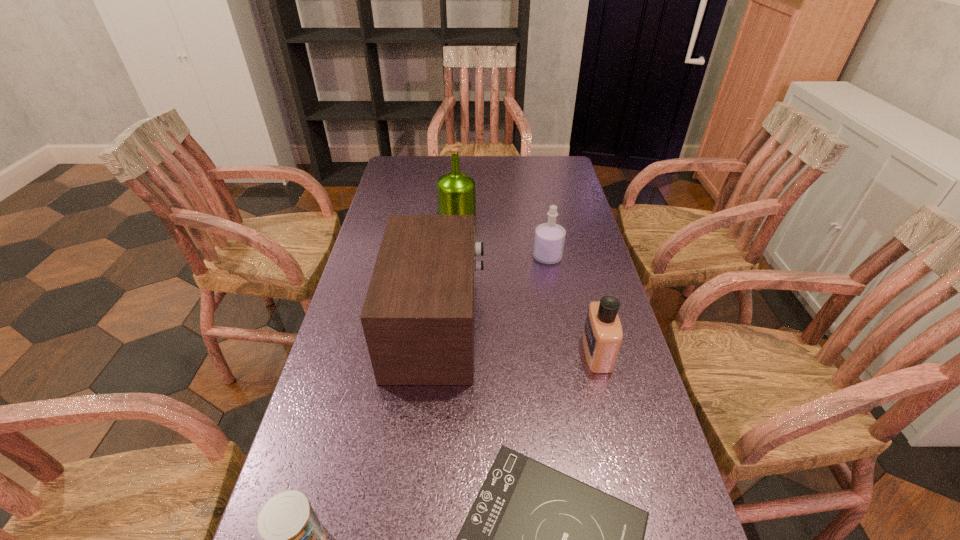
Locate an element on the screen. The image size is (960, 540). object that can be found as the third closest to the leftmost object is located at coordinates (602, 336).